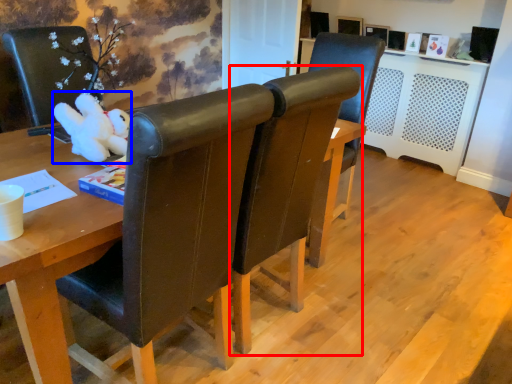
Question: Which object is closer to the camera taking this photo, chair (highlighted by a red box) or toy (highlighted by a blue box)?

Choices:
 (A) chair
 (B) toy

Answer: (A)